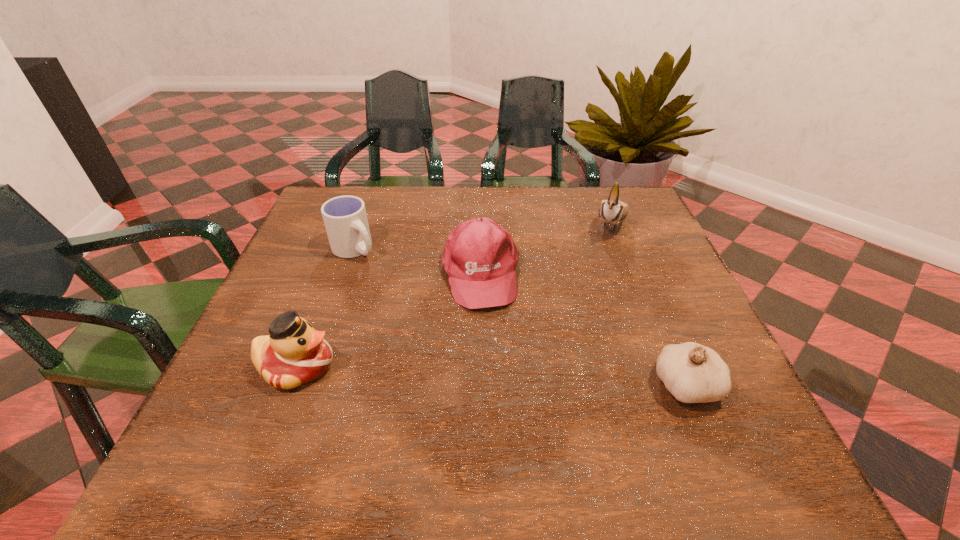
Locate an element on the screen. The height and width of the screenshot is (540, 960). duck is located at coordinates (294, 353).

The width and height of the screenshot is (960, 540). Identify the location of garlic. (693, 373).

Where is `cup`? cup is located at coordinates (345, 218).

Where is `baseball cap`? baseball cap is located at coordinates (480, 258).

At what (x,y) coordinates should I click in order to perform the action: click on the tallest object. Please return your answer as a coordinate pair (x, y). Looking at the image, I should click on (613, 210).

At what (x,y) coordinates should I click in order to perform the action: click on vacant space located on the face of the duck. Please return your answer as a coordinate pair (x, y). Image resolution: width=960 pixels, height=540 pixels. Looking at the image, I should click on (517, 367).

This screenshot has width=960, height=540. In order to click on free space located 0.060m on the back of the garlic in this screenshot , I will do `click(665, 336)`.

Find the location of `vacant space located with the handle on the side of the cup`. vacant space located with the handle on the side of the cup is located at coordinates (435, 326).

Locate an element on the screen. Image resolution: width=960 pixels, height=540 pixels. free space located 0.360m with the handle on the side of the cup is located at coordinates (460, 349).

Locate an element on the screen. The image size is (960, 540). vacant space situated 0.360m with the handle on the side of the cup is located at coordinates (460, 349).